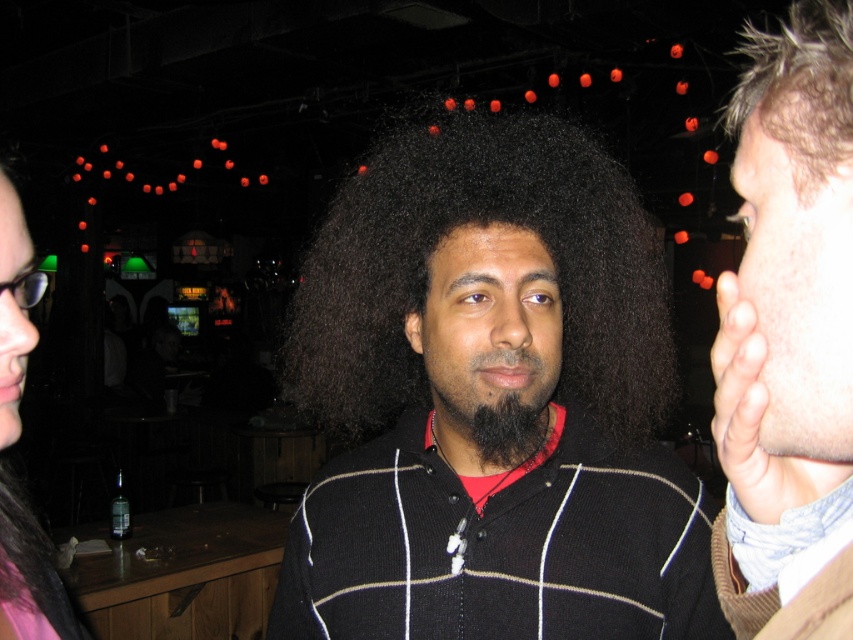
Which is below, black matte sweater at center or smooth skin face at right?

black matte sweater at center

Does black matte sweater at center appear on the right side of smooth skin face at right?

Incorrect, black matte sweater at center is not on the right side of smooth skin face at right.

Locate an element on the screen. black matte sweater at center is located at coordinates (491, 403).

Is black matte sweater at center further to the viewer compared to matte black hair at left?

Yes, it is.

Is black matte sweater at center wider than matte black hair at left?

No.

The width and height of the screenshot is (853, 640). Find the location of `black matte sweater at center`. black matte sweater at center is located at coordinates (x=491, y=403).

Measure the distance from smooth skin face at right to matte black hair at left.

smooth skin face at right is 61.24 centimeters from matte black hair at left.

Does smooth skin face at right have a lesser width compared to matte black hair at left?

Yes.

What are the coordinates of `smooth skin face at right` in the screenshot? It's located at (788, 337).

Identify the location of smooth skin face at right. (788, 337).